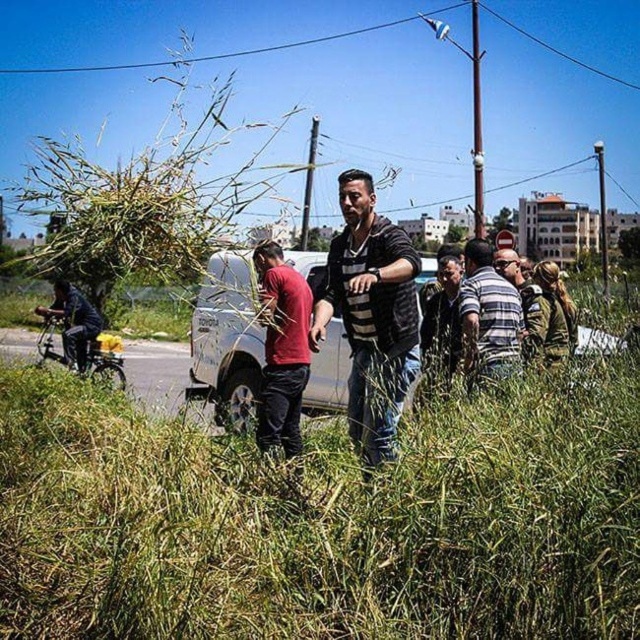
Is green grass at center to the right of striped sweater at center from the viewer's perspective?

Incorrect, green grass at center is not on the right side of striped sweater at center.

Does green grass at center have a smaller size compared to striped sweater at center?

Incorrect, green grass at center is not smaller in size than striped sweater at center.

Which is in front, point (600, 528) or point (406, 301)?

Point (600, 528) is more forward.

Where is `green grass at center`? The image size is (640, 640). green grass at center is located at coordinates (323, 518).

Which is in front, point (545, 400) or point (118, 228)?

Point (118, 228)

At what (x,y) coordinates should I click in order to perform the action: click on green grass at center. Please return your answer as a coordinate pair (x, y). This screenshot has width=640, height=640. Looking at the image, I should click on (323, 518).

I want to click on green grass at center, so click(x=323, y=518).

You are a GUI agent. You are given a task and a screenshot of the screen. Output one action in this format:
    pyautogui.click(x=<x>, y=<y>)
    Task: Click on the green grass at center
    The height and width of the screenshot is (640, 640).
    Given the screenshot: What is the action you would take?
    (x=323, y=518)

Who is lower down, striped sweater at center or white matte van at center?

white matte van at center is lower down.

Which is in front, point (317, 340) or point (257, 394)?

Point (317, 340) is in front.

You are a GUI agent. You are given a task and a screenshot of the screen. Output one action in this format:
    pyautogui.click(x=<x>, y=<y>)
    Task: Click on the striped sweater at center
    
    Given the screenshot: What is the action you would take?
    coord(371,314)